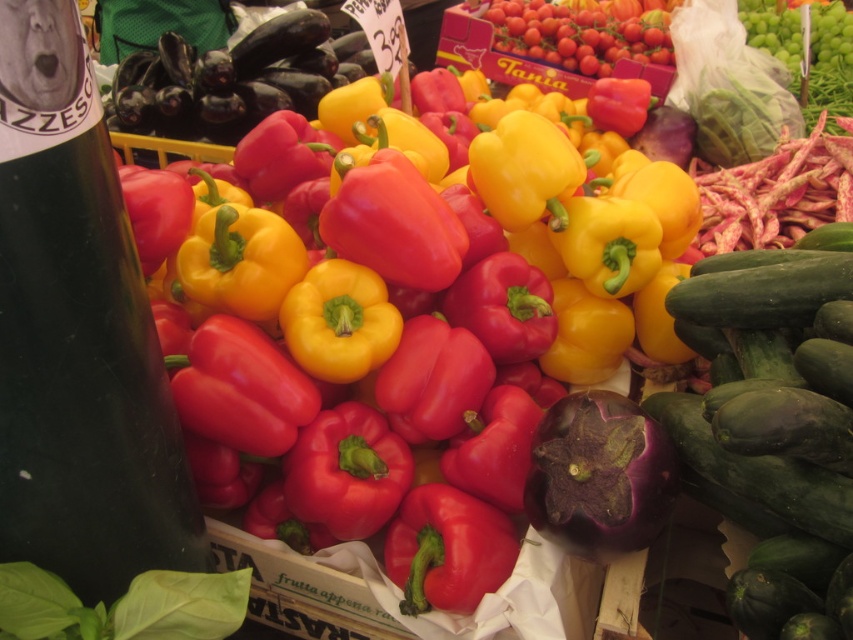
Question: Is shiny red bell pepper at center below green smooth cucumber at right?

Choices:
 (A) no
 (B) yes

Answer: (A)

Question: Which of the following is the farthest from the observer?

Choices:
 (A) green smooth cucumber at right
 (B) shiny red bell pepper at center

Answer: (B)

Question: Can you confirm if shiny red bell pepper at center is positioned to the right of green smooth cucumber at right?

Choices:
 (A) no
 (B) yes

Answer: (A)

Question: Which of the following is the farthest from the observer?

Choices:
 (A) (424, 180)
 (B) (804, 612)

Answer: (A)

Question: Which point is farther to the camera?

Choices:
 (A) (563, 189)
 (B) (793, 358)

Answer: (A)

Question: Can you confirm if shiny red bell pepper at center is bigger than green smooth cucumber at right?

Choices:
 (A) yes
 (B) no

Answer: (A)